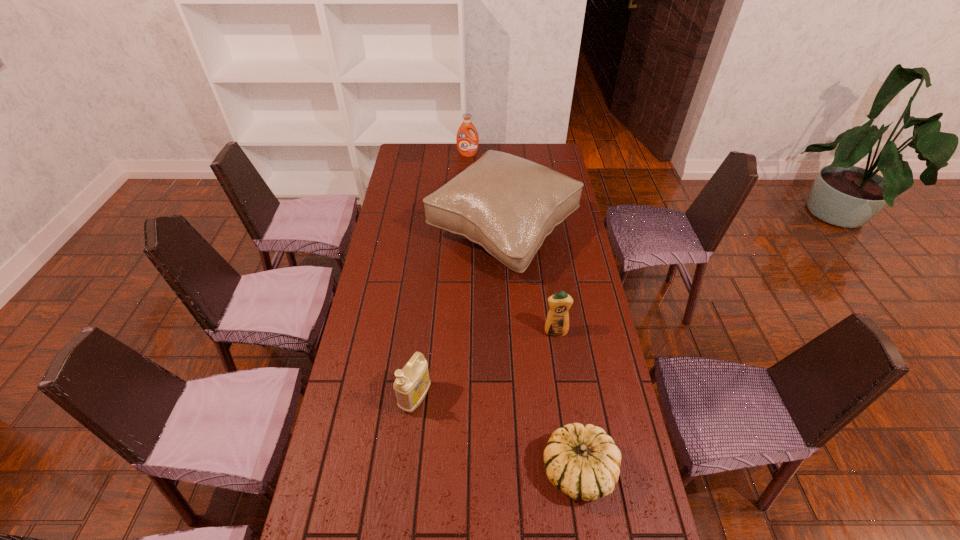
Locate an element on the screen. This screenshot has width=960, height=540. free space located 0.110m on the back of the tallest object is located at coordinates (500, 176).

The image size is (960, 540). In order to click on free region located on the front-facing side of the farthest detergent in this screenshot , I will do `click(467, 189)`.

Identify the location of blank area located on the label of the third nearest object. Image resolution: width=960 pixels, height=540 pixels. (570, 433).

Locate an element on the screen. vacant area situated on the right of the nearest detergent is located at coordinates (564, 398).

You are a GUI agent. You are given a task and a screenshot of the screen. Output one action in this format:
    pyautogui.click(x=<x>, y=<y>)
    Task: Click on the vacant space located 0.180m on the left of the gourd
    This screenshot has width=960, height=540.
    Given the screenshot: What is the action you would take?
    (474, 470)

At what (x,y) coordinates should I click in order to perform the action: click on object that is at the far edge. Please return your answer as a coordinate pair (x, y). The image size is (960, 540). Looking at the image, I should click on (467, 144).

Find the location of a particular element. The image size is (960, 540). cushion present at the right edge is located at coordinates (507, 204).

Image resolution: width=960 pixels, height=540 pixels. Find the location of `detergent located in the right edge section of the desktop`. detergent located in the right edge section of the desktop is located at coordinates (557, 323).

Identify the location of gourd that is at the right edge. (583, 462).

Find the location of a particular element. vacant space at the far edge is located at coordinates (433, 154).